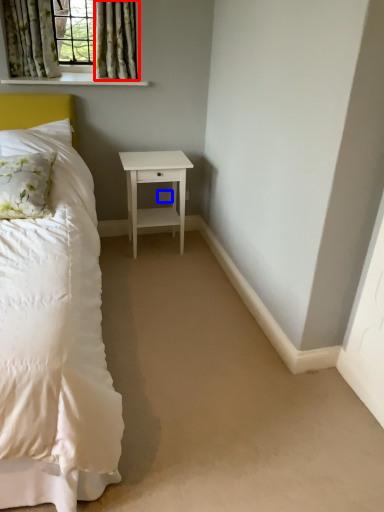
Question: Which object is closer to the camera taking this photo, curtain (highlighted by a red box) or electric outlet (highlighted by a blue box)?

Choices:
 (A) curtain
 (B) electric outlet

Answer: (A)